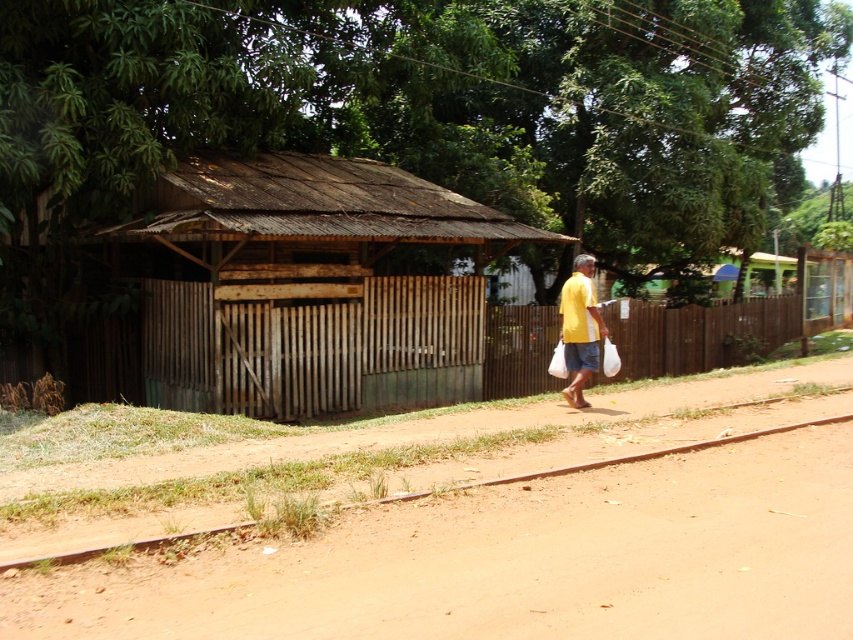
Question: Does brown dirt track at lower left appear on the right side of brown wooden fence at center?

Choices:
 (A) no
 (B) yes

Answer: (A)

Question: Does brown dirt track at lower left appear on the right side of yellow matte shirt at center?

Choices:
 (A) no
 (B) yes

Answer: (A)

Question: Which object appears closest to the camera in this image?

Choices:
 (A) rusty corrugated hut at center
 (B) brown wooden fence at center

Answer: (A)

Question: Where is rusty corrugated hut at center located in relation to brown wooden fence at center in the image?

Choices:
 (A) right
 (B) left

Answer: (B)

Question: Estimate the real-world distances between objects in this image. Which object is closer to the rusty corrugated hut at center?

Choices:
 (A) yellow matte shirt at center
 (B) brown wooden fence at center
 (C) brown dirt track at lower left

Answer: (A)

Question: Which of the following is the farthest from the observer?

Choices:
 (A) brown wooden fence at center
 (B) brown dirt track at lower left

Answer: (A)